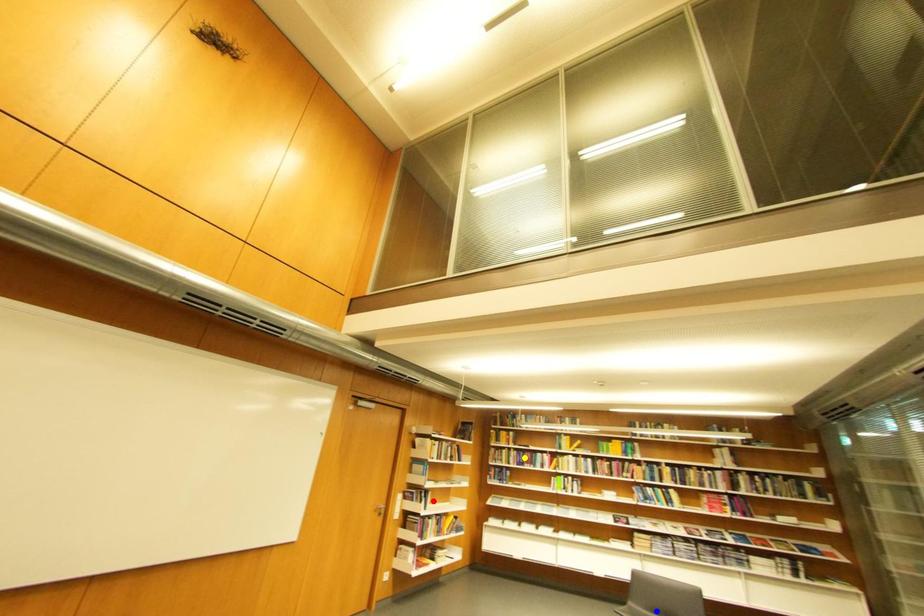
Order these from nearest to farthest:
red point | yellow point | blue point

blue point < red point < yellow point